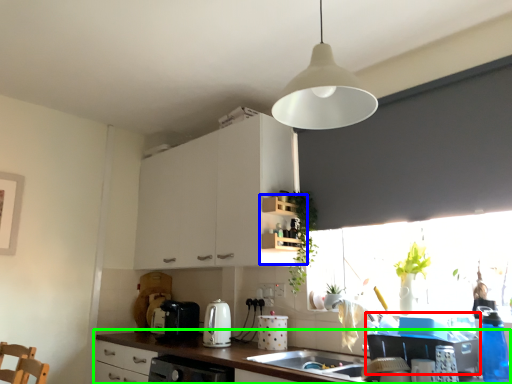
Question: Which is farther away from appliance (highlighted by a red box)? shelf (highlighted by a blue box) or countertop (highlighted by a green box)?

Choices:
 (A) shelf
 (B) countertop

Answer: (A)